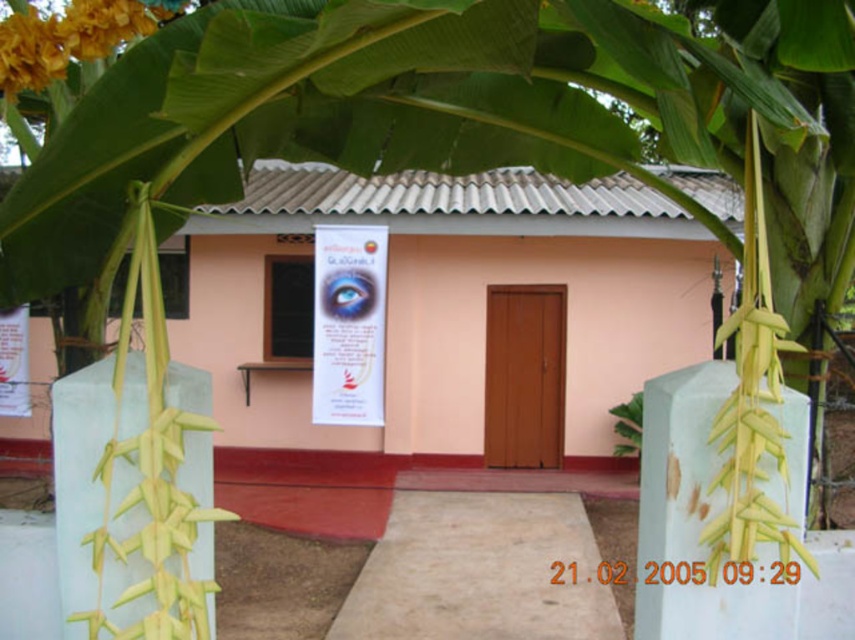
Is yellow papery flower at upper left shorter than green leafy plant at center?

Indeed, yellow papery flower at upper left has a lesser height compared to green leafy plant at center.

Between yellow papery flower at upper left and green leafy plant at center, which one has more height?

Standing taller between the two is green leafy plant at center.

Is point (44, 45) closer to viewer compared to point (618, 422)?

Yes, it is in front of point (618, 422).

Locate an element on the screen. This screenshot has height=640, width=855. yellow papery flower at upper left is located at coordinates (68, 38).